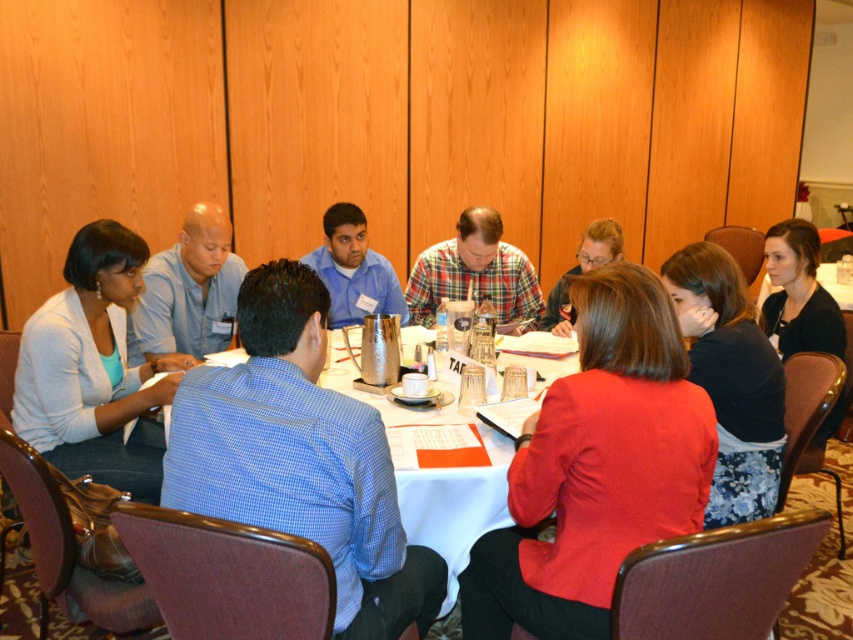
Looking at this image, who is more distant from viewer, (479, 224) or (323, 266)?

Point (323, 266)

Find the location of a particular element. This screenshot has height=640, width=853. plaid fabric shirt at center is located at coordinates (474, 273).

Does matte red blazer at center come in front of white paper at center?

Yes, matte red blazer at center is closer to the viewer.

How far apart are matte red blazer at center and white paper at center?

matte red blazer at center is 15.98 inches away from white paper at center.

Locate an element on the screen. matte red blazer at center is located at coordinates (596, 467).

Where is `matte red blazer at center`? The width and height of the screenshot is (853, 640). matte red blazer at center is located at coordinates (596, 467).

Is white paper at center positioned before blue shirt at center?

Yes, white paper at center is in front of blue shirt at center.

Who is taller, white paper at center or blue shirt at center?

Standing taller between the two is white paper at center.

Between point (547, 353) and point (387, 273), which one is positioned in front?

Point (547, 353)

Where is `white paper at center`? white paper at center is located at coordinates (448, 506).